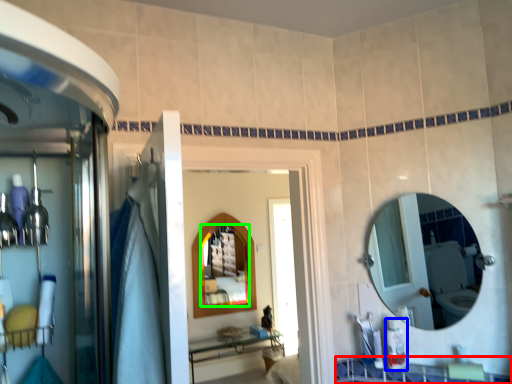
Question: Which object is positioned closest to counter top (highlighted by a red box)? Select from toiletry (highlighted by a blue box) and mirror (highlighted by a green box).

Choices:
 (A) toiletry
 (B) mirror

Answer: (A)